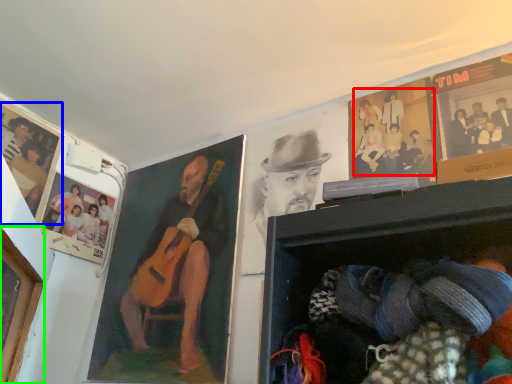
Question: Based on their relative distances, which object is nearer to person (highlighted by a red box)? Choose from poster page (highlighted by a blue box) and portrait (highlighted by a green box).

Choices:
 (A) poster page
 (B) portrait

Answer: (B)